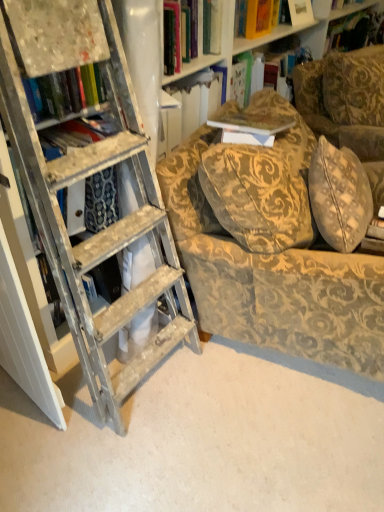
Find the location of a particular element. gold-patterned fabric chair at center is located at coordinates (270, 250).

The image size is (384, 512). What do you see at coordinates (270, 250) in the screenshot?
I see `gold-patterned fabric chair at center` at bounding box center [270, 250].

Measure the distance between gold-patterned fabric chair at center and camera.

3.98 feet.

What is the approximate height of hardcover book at upper center?

The height of hardcover book at upper center is 11.10 inches.

The width and height of the screenshot is (384, 512). I want to click on hardcover book at upper center, so click(283, 58).

The image size is (384, 512). What do you see at coordinates (283, 58) in the screenshot?
I see `hardcover book at upper center` at bounding box center [283, 58].

What is the approximate width of hardcover book at upper center?

hardcover book at upper center is 32.08 centimeters wide.

The height and width of the screenshot is (512, 384). Find the location of `gold-patterned fabric chair at center`. gold-patterned fabric chair at center is located at coordinates (270, 250).

Visually, is gold-patterned fabric chair at center positioned to the left or to the right of hardcover book at upper center?

From the image, it's evident that gold-patterned fabric chair at center is to the left of hardcover book at upper center.

Which object is closer to the camera taking this photo, gold-patterned fabric chair at center or hardcover book at upper center?

gold-patterned fabric chair at center.

Considering the points (179, 230) and (293, 87), which point is in front, point (179, 230) or point (293, 87)?

The point (179, 230) is more forward.

From the image's perspective, would you say gold-patterned fabric chair at center is positioned over hardcover book at upper center?

No, from the image's perspective, gold-patterned fabric chair at center is not over hardcover book at upper center.

Based on the photo, from a real-world perspective, who is located higher, gold-patterned fabric chair at center or hardcover book at upper center?

hardcover book at upper center, from a real-world perspective.

Can you confirm if gold-patterned fabric chair at center is thinner than hardcover book at upper center?

In fact, gold-patterned fabric chair at center might be wider than hardcover book at upper center.

Looking at this image, considering the relative sizes of gold-patterned fabric chair at center and hardcover book at upper center in the image provided, is gold-patterned fabric chair at center shorter than hardcover book at upper center?

No, gold-patterned fabric chair at center is not shorter than hardcover book at upper center.

Considering the relative sizes of gold-patterned fabric chair at center and hardcover book at upper center in the image provided, is gold-patterned fabric chair at center bigger than hardcover book at upper center?

Yes, gold-patterned fabric chair at center is bigger than hardcover book at upper center.

Is gold-patterned fabric chair at center completely or partially outside of hardcover book at upper center?

gold-patterned fabric chair at center is positioned outside hardcover book at upper center.

Is gold-patterned fabric chair at center not close to hardcover book at upper center?

Absolutely, gold-patterned fabric chair at center is distant from hardcover book at upper center.

Is gold-patterned fabric chair at center facing towards hardcover book at upper center?

No, gold-patterned fabric chair at center is not facing towards hardcover book at upper center.

You are a GUI agent. You are given a task and a screenshot of the screen. Output one action in this format:
    pyautogui.click(x=<x>, y=<y>)
    Task: Click on the chair below the hardcover book at upper center (from the image's perspective)
    The height and width of the screenshot is (512, 384).
    Given the screenshot: What is the action you would take?
    pyautogui.click(x=270, y=250)

Considering the positions of objects hardcover book at upper center and gold-patterned fabric chair at center in the image provided, who is more to the right, hardcover book at upper center or gold-patterned fabric chair at center?

hardcover book at upper center.

Is hardcover book at upper center further to the viewer compared to gold-patterned fabric chair at center?

Yes, it is behind gold-patterned fabric chair at center.

Which point is more distant from viewer, (278, 58) or (272, 266)?

The point (278, 58) is behind.

From the image's perspective, which is above, hardcover book at upper center or gold-patterned fabric chair at center?

hardcover book at upper center is shown above in the image.

From a real-world perspective, is hardcover book at upper center below gold-patterned fabric chair at center?

Incorrect, from a real-world perspective, hardcover book at upper center is higher than gold-patterned fabric chair at center.

In the scene shown: Does hardcover book at upper center have a lesser width compared to gold-patterned fabric chair at center?

Yes.

Which of these two, hardcover book at upper center or gold-patterned fabric chair at center, stands shorter?

hardcover book at upper center is shorter.

Is hardcover book at upper center smaller than gold-patterned fabric chair at center?

Indeed, hardcover book at upper center has a smaller size compared to gold-patterned fabric chair at center.

Is hardcover book at upper center inside the boundaries of gold-patterned fabric chair at center, or outside?

The correct answer is: outside.

Consider the image. Is hardcover book at upper center touching gold-patterned fabric chair at center?

hardcover book at upper center is not next to gold-patterned fabric chair at center, and they're not touching.

Is hardcover book at upper center oriented towards gold-patterned fabric chair at center?

No.

What's the angular difference between hardcover book at upper center and gold-patterned fabric chair at center's facing directions?

11.3 degrees separate the facing orientations of hardcover book at upper center and gold-patterned fabric chair at center.

In order to click on book that is above the gold-patterned fabric chair at center (from a real-world perspective) in this screenshot , I will do pos(283,58).

The height and width of the screenshot is (512, 384). I want to click on chair that appears in front of the hardcover book at upper center, so click(270, 250).

Find the location of a particular element. Image resolution: width=384 pixels, height=512 pixels. book behind the gold-patterned fabric chair at center is located at coordinates (283, 58).